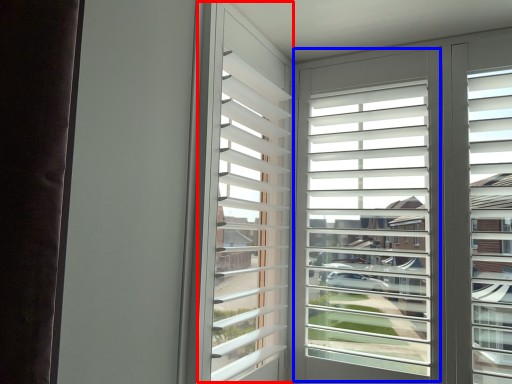
Question: Among these objects, which one is farthest to the camera, bay window (highlighted by a red box) or window screen (highlighted by a blue box)?

Choices:
 (A) bay window
 (B) window screen

Answer: (B)